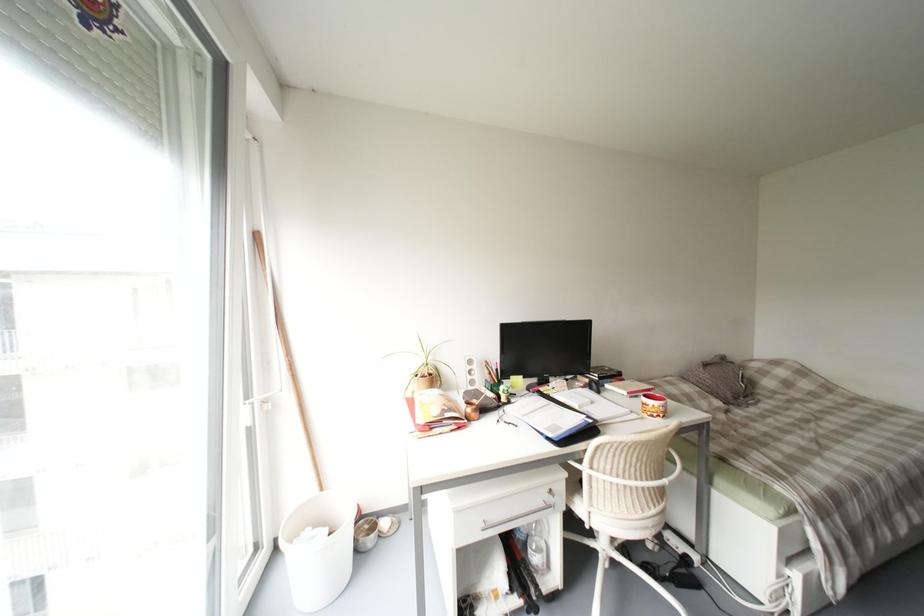
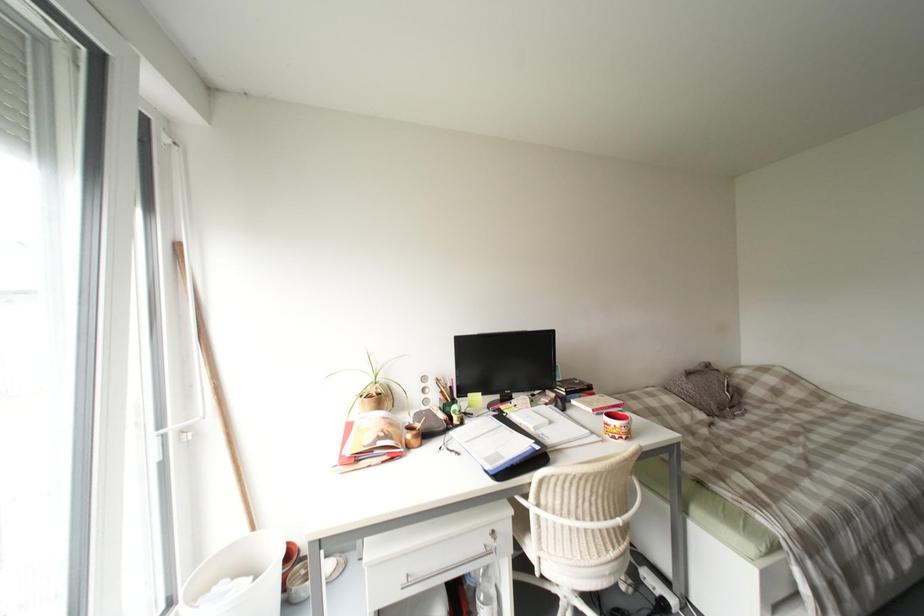
In a continuous first-person perspective shot, in which direction is the camera moving?

The movement direction of the cameraman is right, forward.